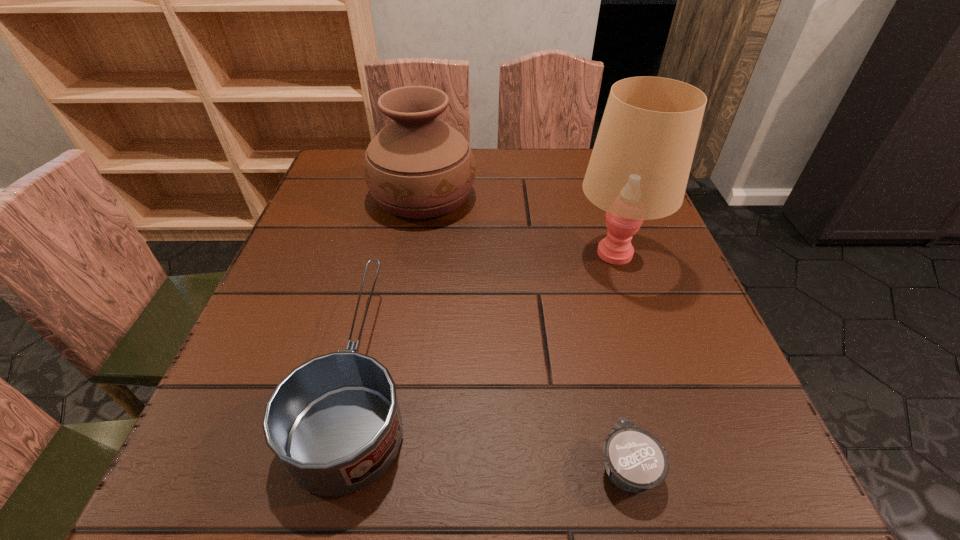
I want to click on lampshade, so click(640, 164).

Locate an element on the screen. The width and height of the screenshot is (960, 540). the second tallest object is located at coordinates (419, 167).

At what (x,y) coordinates should I click in order to perform the action: click on the third tallest object. Please return your answer as a coordinate pair (x, y). Image resolution: width=960 pixels, height=540 pixels. Looking at the image, I should click on (334, 422).

Identify the location of the shortest object. 635,460.

Where is `free space located on the front of the tallest object`? The width and height of the screenshot is (960, 540). free space located on the front of the tallest object is located at coordinates (691, 476).

Image resolution: width=960 pixels, height=540 pixels. I want to click on free space located 0.110m on the left of the third shortest object, so click(324, 195).

What are the coordinates of `free space located with the handle extending from one side of the third tallest object` in the screenshot? It's located at 394,228.

This screenshot has width=960, height=540. I want to click on vacant region located with the handle extending from one side of the third tallest object, so click(403, 186).

This screenshot has height=540, width=960. What are the coordinates of `vacant region located with the handle extending from one side of the third tallest object` in the screenshot? It's located at (397, 215).

Find the location of a particular element. free space located on the back of the shortest object is located at coordinates (599, 352).